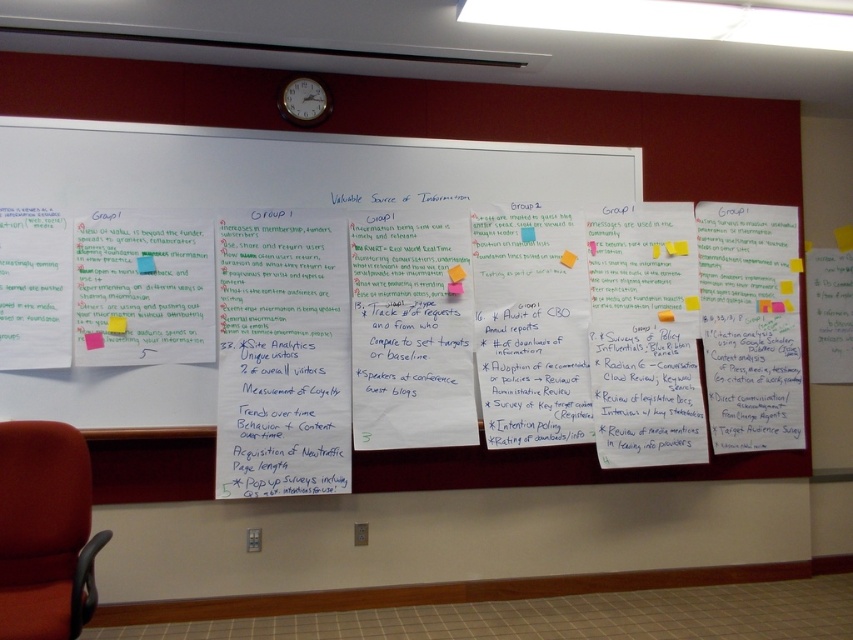
You are a visitor in the room and need to sit down. You see the red fabric chair at lower left and the yellow sticky note at lower left. Which one can you sit on?

The red fabric chair at lower left is larger in size than yellow sticky note at lower left, so you can sit on the red fabric chair at lower left.